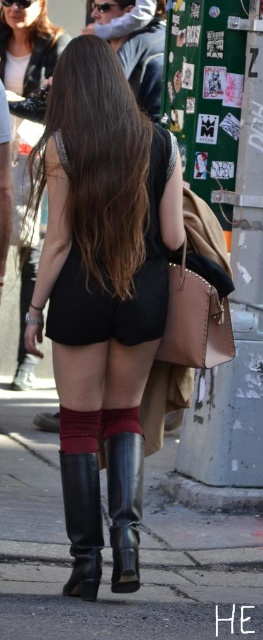
Question: Among these points, which one is nearest to the camera?

Choices:
 (A) (76, 534)
 (B) (115, 225)
 (C) (29, 97)
 (D) (117, 436)

Answer: (B)

Question: Can you confirm if matte black shorts at center is thinner than shiny black leather boot at lower center?

Choices:
 (A) yes
 (B) no

Answer: (B)

Question: Does matte black boots at lower center appear under black leather boot at lower center?

Choices:
 (A) yes
 (B) no

Answer: (B)

Question: Does matte black shorts at center have a larger size compared to matte black boots at lower center?

Choices:
 (A) yes
 (B) no

Answer: (A)

Question: Which object is farther from the camera taking this photo?

Choices:
 (A) shiny black leather boot at lower center
 (B) matte black shorts at center

Answer: (B)

Question: Which point is closer to the camera?

Choices:
 (A) matte black boots at lower center
 (B) dark brown hair at center
 (C) black leather boot at lower center
 (D) shiny black leather boot at lower center

Answer: (D)